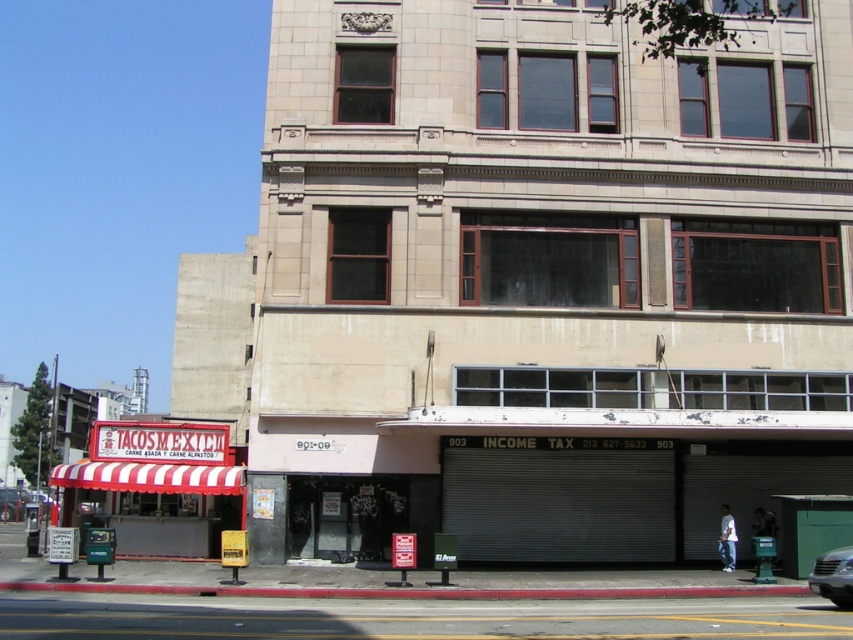
Is red and white striped awning at lower left to the left of silver metallic car at lower right from the viewer's perspective?

Correct, you'll find red and white striped awning at lower left to the left of silver metallic car at lower right.

Is red and white striped awning at lower left positioned at the back of silver metallic car at lower right?

Yes, red and white striped awning at lower left is further from the viewer.

At what (x,y) coordinates should I click in order to perform the action: click on red and white striped awning at lower left. Please return your answer as a coordinate pair (x, y). Looking at the image, I should click on (160, 484).